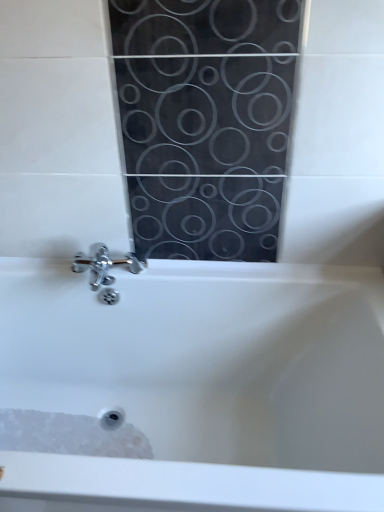
Question: Looking at their shapes, would you say white glossy bathtub at center is wider or thinner than white textured foam at bottom left?

Choices:
 (A) thin
 (B) wide

Answer: (B)

Question: From the image's perspective, is white glossy bathtub at center positioned above or below white textured foam at bottom left?

Choices:
 (A) above
 (B) below

Answer: (A)

Question: Looking at the image, does white glossy bathtub at center seem bigger or smaller compared to white textured foam at bottom left?

Choices:
 (A) big
 (B) small

Answer: (A)

Question: In the image, is white textured foam at bottom left positioned in front of or behind white glossy bathtub at center?

Choices:
 (A) behind
 (B) front

Answer: (A)

Question: From their relative heights in the image, would you say white textured foam at bottom left is taller or shorter than white glossy bathtub at center?

Choices:
 (A) tall
 (B) short

Answer: (B)

Question: Looking at the image, does white textured foam at bottom left seem bigger or smaller compared to white glossy bathtub at center?

Choices:
 (A) small
 (B) big

Answer: (A)

Question: Based on their positions, is white textured foam at bottom left located to the left or right of white glossy bathtub at center?

Choices:
 (A) right
 (B) left

Answer: (B)